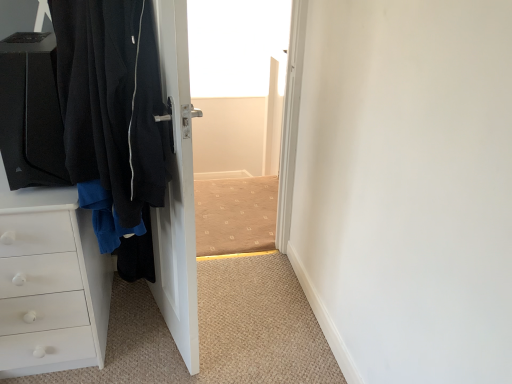
Question: From the image's perspective, is white matte chest of drawers at left beneath black fabric door at left?

Choices:
 (A) no
 (B) yes

Answer: (B)

Question: Is white matte chest of drawers at left wider than black fabric door at left?

Choices:
 (A) yes
 (B) no

Answer: (A)

Question: Does white matte chest of drawers at left have a larger size compared to black fabric door at left?

Choices:
 (A) no
 (B) yes

Answer: (B)

Question: Is white matte chest of drawers at left outside of black fabric door at left?

Choices:
 (A) no
 (B) yes

Answer: (B)

Question: Is white matte chest of drawers at left further to the viewer compared to black fabric door at left?

Choices:
 (A) no
 (B) yes

Answer: (B)

Question: Does white matte chest of drawers at left have a greater height compared to black fabric door at left?

Choices:
 (A) no
 (B) yes

Answer: (A)

Question: Would you say black fabric door at left is outside white matte chest of drawers at left?

Choices:
 (A) no
 (B) yes

Answer: (B)

Question: From a real-world perspective, is black fabric door at left on top of white matte chest of drawers at left?

Choices:
 (A) yes
 (B) no

Answer: (A)

Question: Is black fabric door at left bigger than white matte chest of drawers at left?

Choices:
 (A) yes
 (B) no

Answer: (B)

Question: Can white matte chest of drawers at left be found inside black fabric door at left?

Choices:
 (A) yes
 (B) no

Answer: (B)

Question: From a real-world perspective, is black fabric door at left beneath white matte chest of drawers at left?

Choices:
 (A) yes
 (B) no

Answer: (B)

Question: Is black fabric door at left further to camera compared to white matte chest of drawers at left?

Choices:
 (A) yes
 (B) no

Answer: (B)

Question: Considering the positions of white matte chest of drawers at left and black fabric door at left in the image, is white matte chest of drawers at left taller or shorter than black fabric door at left?

Choices:
 (A) short
 (B) tall

Answer: (A)